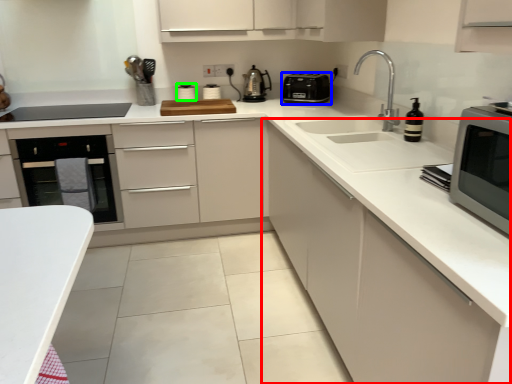
Question: Based on their relative distances, which object is farther from cabinetry (highlighted by a red box)? Choose from kitchen appliance (highlighted by a blue box) and appliance (highlighted by a green box).

Choices:
 (A) kitchen appliance
 (B) appliance

Answer: (B)